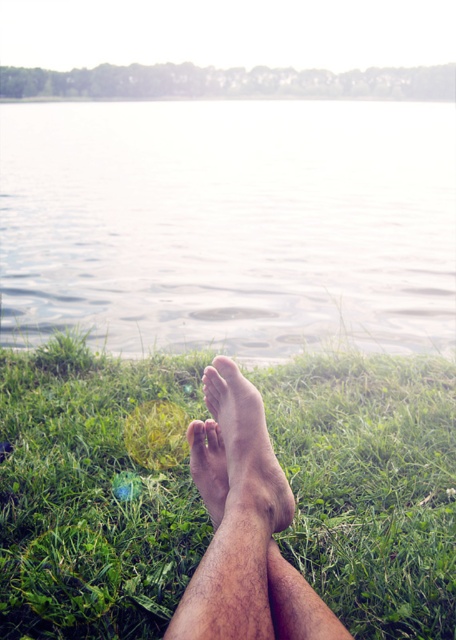
Does point (242, 506) lie in front of point (205, 467)?

That is True.

Who is more distant from viewer, [219,368] or [206,452]?

Point [206,452]

Which is in front, point (208, 397) or point (211, 508)?

Positioned in front is point (211, 508).

Where is `brown rough skin at lower center`? Image resolution: width=456 pixels, height=640 pixels. brown rough skin at lower center is located at coordinates (242, 458).

Measure the distance between hair-covered skin feet at center and brown rough skin at lower center.

hair-covered skin feet at center and brown rough skin at lower center are 1.05 inches apart.

Is hair-covered skin feet at center below brown rough skin at lower center?

Yes.

From the picture: Who is more forward, (254, 540) or (259, 472)?

Point (254, 540) is more forward.

Locate an element on the screen. This screenshot has width=456, height=640. hair-covered skin feet at center is located at coordinates (243, 528).

Is point (191, 333) farther from camera compared to point (219, 436)?

Yes, point (191, 333) is behind point (219, 436).

Which is more to the right, clear water at center or skinny barefoot at lower center?

skinny barefoot at lower center

Image resolution: width=456 pixels, height=640 pixels. Identify the location of clear water at center. (228, 225).